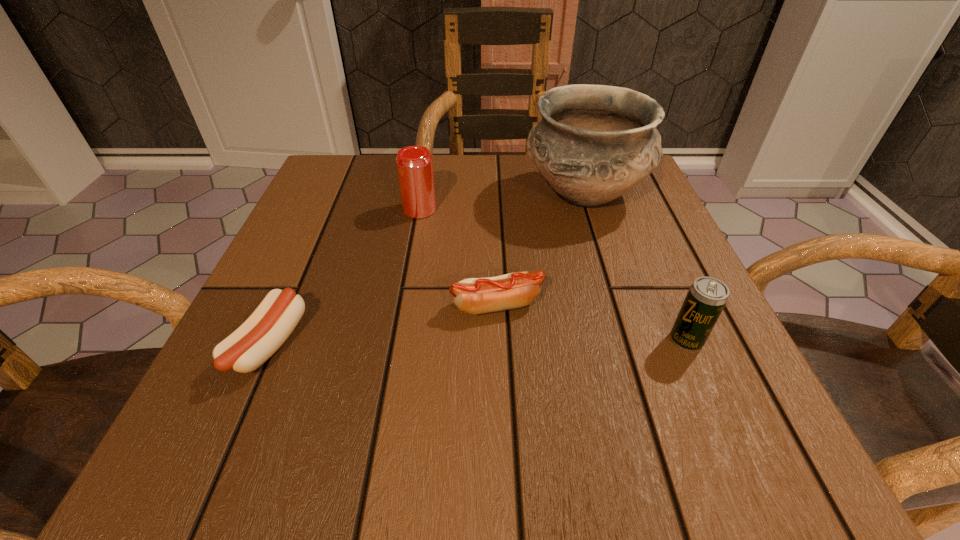
In the image, there is a desktop. Where is `vacant space at the left edge`? vacant space at the left edge is located at coordinates (263, 406).

Where is `vacant space at the far left corner of the desktop`? The image size is (960, 540). vacant space at the far left corner of the desktop is located at coordinates coord(351,177).

The image size is (960, 540). What are the coordinates of `free space at the near left corner` in the screenshot? It's located at click(x=172, y=475).

What are the coordinates of `empty space between the pottery and the right sausage` in the screenshot? It's located at (540, 251).

The height and width of the screenshot is (540, 960). I want to click on free space between the right sausage and the tallest object, so click(x=540, y=251).

Locate an element on the screen. This screenshot has width=960, height=540. free spot between the shorter beer can and the pottery is located at coordinates (636, 267).

Locate an element on the screen. The image size is (960, 540). empty location between the right sausage and the pottery is located at coordinates (540, 251).

Identify the location of free point between the tallest object and the third tallest object. (636, 267).

This screenshot has width=960, height=540. I want to click on vacant area between the leftmost object and the farther beer can, so click(344, 277).

Where is `free space between the right sausage and the tallest object`? The image size is (960, 540). free space between the right sausage and the tallest object is located at coordinates (540, 251).